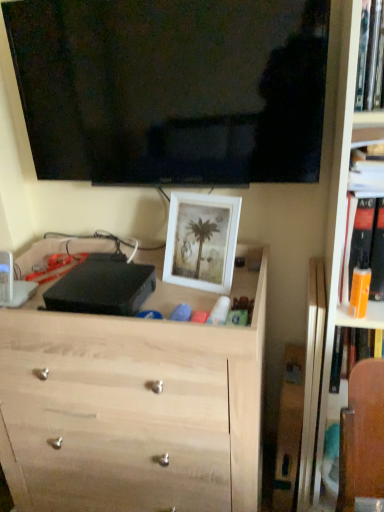
Question: Does hardcover book at upper right, which ranks as the second book in top-to-bottom order, have a lesser width compared to white matte picture frame at center?

Choices:
 (A) no
 (B) yes

Answer: (A)

Question: Is hardcover book at upper right, which is counted as the second book, starting from the bottom, further to the viewer compared to white matte picture frame at center?

Choices:
 (A) no
 (B) yes

Answer: (A)

Question: Does hardcover book at upper right, which is counted as the second book, starting from the bottom, appear on the right side of white matte picture frame at center?

Choices:
 (A) no
 (B) yes

Answer: (B)

Question: From a real-world perspective, is hardcover book at upper right, which is counted as the second book, starting from the bottom, on top of white matte picture frame at center?

Choices:
 (A) yes
 (B) no

Answer: (A)

Question: Does hardcover book at upper right, which ranks as the second book in top-to-bottom order, have a smaller size compared to white matte picture frame at center?

Choices:
 (A) yes
 (B) no

Answer: (A)

Question: In terms of width, does hardcover book at upper right, the third book when ordered from bottom to top, look wider or thinner when compared to orange plastic bottle at right, which ranks as the third book in top-to-bottom order?

Choices:
 (A) thin
 (B) wide

Answer: (B)

Question: Is hardcover book at upper right, the first book positioned from the top, to the left or to the right of orange plastic bottle at right, the first book from the bottom, in the image?

Choices:
 (A) left
 (B) right

Answer: (A)

Question: In terms of height, does hardcover book at upper right, the first book positioned from the top, look taller or shorter compared to orange plastic bottle at right, the first book from the bottom?

Choices:
 (A) tall
 (B) short

Answer: (A)

Question: Choose the correct answer: Is hardcover book at upper right, the third book when ordered from bottom to top, inside orange plastic bottle at right, which ranks as the third book in top-to-bottom order, or outside it?

Choices:
 (A) outside
 (B) inside

Answer: (A)

Question: Is white matte picture frame at center to the left or to the right of light wood chest of drawers at center in the image?

Choices:
 (A) left
 (B) right

Answer: (B)

Question: Choose the correct answer: Is white matte picture frame at center inside light wood chest of drawers at center or outside it?

Choices:
 (A) outside
 (B) inside

Answer: (B)

Question: From their relative heights in the image, would you say white matte picture frame at center is taller or shorter than light wood chest of drawers at center?

Choices:
 (A) tall
 (B) short

Answer: (B)

Question: From the image's perspective, relative to light wood chest of drawers at center, is white matte picture frame at center above or below?

Choices:
 (A) below
 (B) above

Answer: (B)

Question: Is hardcover book at upper right, which ranks as the second book in top-to-bottom order, wider or thinner than orange plastic bottle at right, which ranks as the third book in top-to-bottom order?

Choices:
 (A) thin
 (B) wide

Answer: (A)

Question: Is hardcover book at upper right, which ranks as the second book in top-to-bottom order, bigger or smaller than orange plastic bottle at right, the first book from the bottom?

Choices:
 (A) small
 (B) big

Answer: (A)